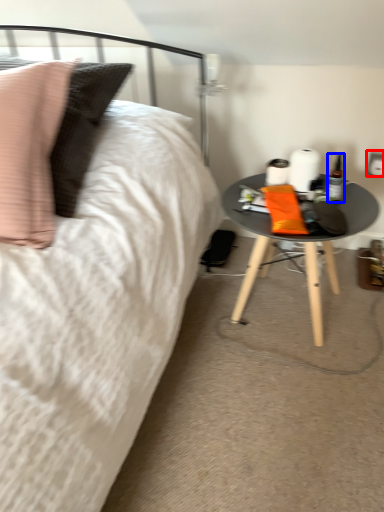
Question: Which object appears closest to the camera in this image, electric outlet (highlighted by a red box) or bottle (highlighted by a blue box)?

Choices:
 (A) electric outlet
 (B) bottle

Answer: (B)